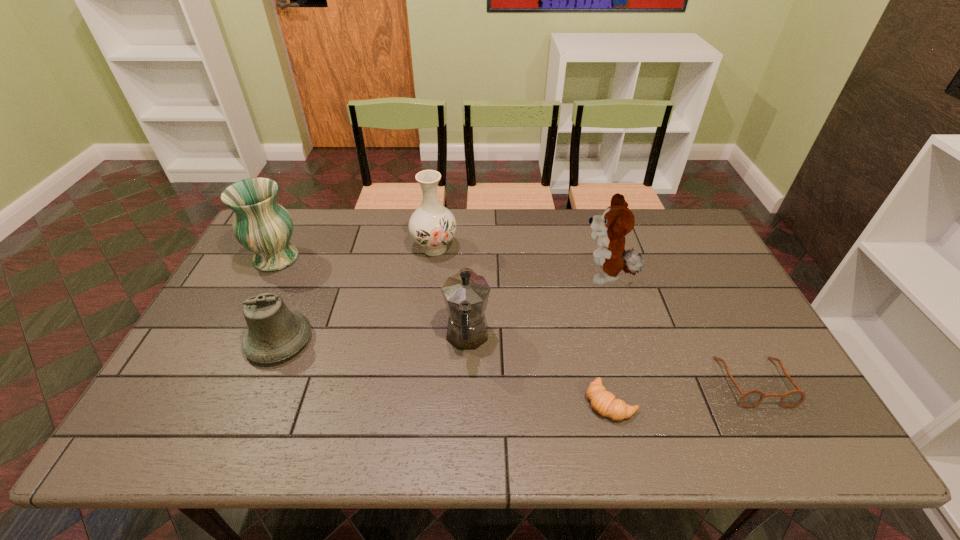
This screenshot has width=960, height=540. In order to click on unoccupied area between the shortest object and the left vase in this screenshot , I will do `click(444, 330)`.

Identify the location of free space between the rightmost object and the puppy. (681, 329).

Where is `empty space that is in between the right vase and the crescent roll`? The width and height of the screenshot is (960, 540). empty space that is in between the right vase and the crescent roll is located at coordinates (522, 325).

In order to click on vacant space in between the coffeepot and the shortest object in this screenshot , I will do `click(539, 369)`.

Where is `empty location between the crescent roll and the left vase`? The height and width of the screenshot is (540, 960). empty location between the crescent roll and the left vase is located at coordinates pos(444,330).

Where is `free space that is in between the shortest object and the spectacles`? free space that is in between the shortest object and the spectacles is located at coordinates (683, 392).

Identify the location of vacant point located between the coffeepot and the shortest object. The width and height of the screenshot is (960, 540). (539, 369).

Locate an element on the screen. free space between the spectacles and the bell is located at coordinates (516, 361).

Image resolution: width=960 pixels, height=540 pixels. Find the location of `object that can be found as the third closest to the shortest object`. object that can be found as the third closest to the shortest object is located at coordinates (610, 229).

Where is `object identified as the sixth closest to the spectacles`? The image size is (960, 540). object identified as the sixth closest to the spectacles is located at coordinates (261, 225).